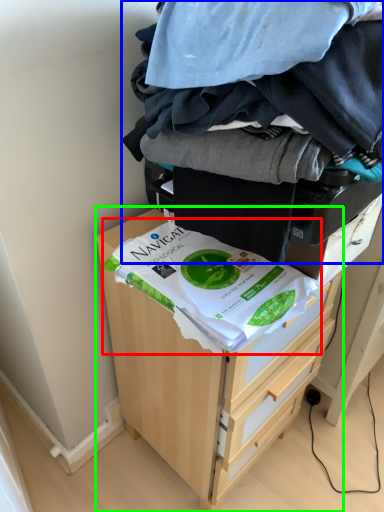
Question: Which object is the closest to the food (highlighted by a red box)? Choose among these: laundry (highlighted by a blue box) or chest of drawers (highlighted by a green box).

Choices:
 (A) laundry
 (B) chest of drawers

Answer: (A)